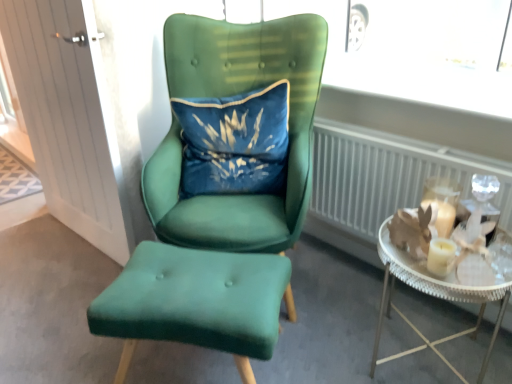
Identify the location of vacant space in white wood door at left (from a real-world perspective). (87, 239).